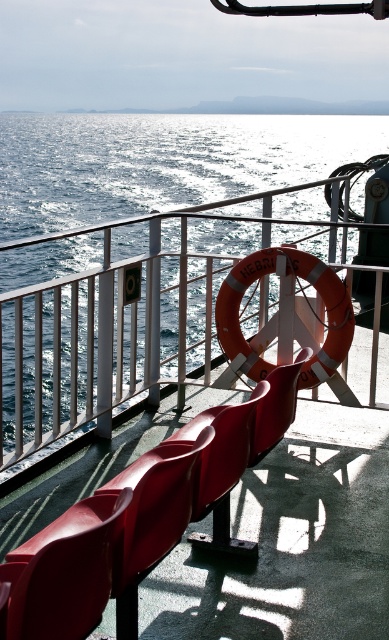
Is blue water at center positioned in front of matte plastic chair at center?

No.

Who is positioned more to the left, blue water at center or matte plastic chair at center?

blue water at center is more to the left.

You are a GUI agent. You are given a task and a screenshot of the screen. Output one action in this format:
    pyautogui.click(x=<x>, y=<y>)
    Task: Click on the blue water at center
    This screenshot has width=389, height=640.
    Given the screenshot: What is the action you would take?
    pyautogui.click(x=152, y=260)

This screenshot has width=389, height=640. In order to click on blue water at center in this screenshot , I will do `click(152, 260)`.